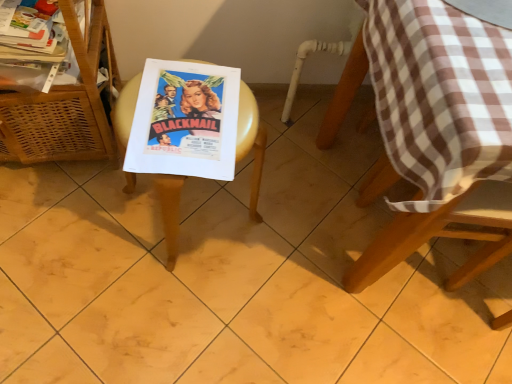
Locate an element on the screen. vacant space underneath brown checkered tablecloth at upper right (from a real-world perspective) is located at coordinates (340, 182).